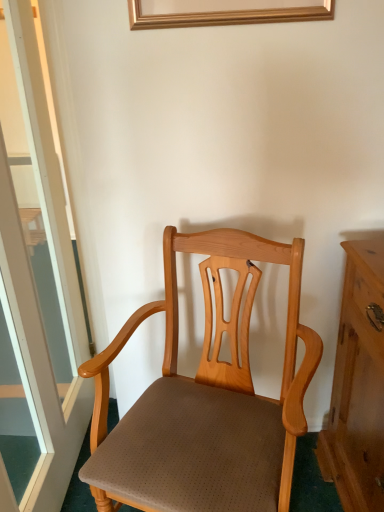
The height and width of the screenshot is (512, 384). What do you see at coordinates (35, 288) in the screenshot?
I see `transparent glass door at left` at bounding box center [35, 288].

Find the location of `transparent glass door at left`. transparent glass door at left is located at coordinates (35, 288).

What do you see at coordinates (204, 405) in the screenshot? I see `light brown wood chair at center` at bounding box center [204, 405].

In order to click on light brown wood chair at center in this screenshot , I will do `click(204, 405)`.

You are a GUI agent. You are given a task and a screenshot of the screen. Output one action in this format:
    pyautogui.click(x=<x>, y=<y>)
    Task: Click on the transparent glass door at left
    
    Given the screenshot: What is the action you would take?
    pyautogui.click(x=35, y=288)

Is transparent glass door at left to the left of light brown wood chair at center from the viewer's perspective?

Indeed, transparent glass door at left is positioned on the left side of light brown wood chair at center.

In the scene shown: Which object is more forward, transparent glass door at left or light brown wood chair at center?

transparent glass door at left.

Is point (24, 97) positioned after point (210, 402)?

Yes.

From the image's perspective, would you say transparent glass door at left is shown under light brown wood chair at center?

Actually, transparent glass door at left appears above light brown wood chair at center in the image.

From a real-world perspective, is transparent glass door at left above or below light brown wood chair at center?

transparent glass door at left is situated higher than light brown wood chair at center in the real world.

Considering the relative sizes of transparent glass door at left and light brown wood chair at center in the image provided, is transparent glass door at left wider than light brown wood chair at center?

No.

Between transparent glass door at left and light brown wood chair at center, which one has more height?

transparent glass door at left is taller.

Looking at the image, does transparent glass door at left seem bigger or smaller compared to light brown wood chair at center?

transparent glass door at left is smaller than light brown wood chair at center.

Choose the correct answer: Is transparent glass door at left inside light brown wood chair at center or outside it?

transparent glass door at left is outside light brown wood chair at center.

Are transparent glass door at left and light brown wood chair at center beside each other?

No.

Is light brown wood chair at center at the back of transparent glass door at left?

Yes.

How much distance is there between transparent glass door at left and light brown wood chair at center?

52.26 centimeters.

The width and height of the screenshot is (384, 512). I want to click on window that is in front of the light brown wood chair at center, so click(x=35, y=288).

Is light brown wood chair at center to the left of transparent glass door at left from the viewer's perspective?

Incorrect, light brown wood chair at center is not on the left side of transparent glass door at left.

Is light brown wood chair at center positioned behind transparent glass door at left?

Yes, it is behind transparent glass door at left.

Is point (247, 249) closer or farther from the camera than point (21, 106)?

Point (247, 249) appears to be closer to the viewer than point (21, 106).

From the image's perspective, which is above, light brown wood chair at center or transparent glass door at left?

transparent glass door at left is shown above in the image.

From a real-world perspective, who is located lower, light brown wood chair at center or transparent glass door at left?

light brown wood chair at center is physically lower.

Does light brown wood chair at center have a greater width compared to transparent glass door at left?

Indeed, light brown wood chair at center has a greater width compared to transparent glass door at left.

From the picture: Which of these two, light brown wood chair at center or transparent glass door at left, stands taller?

Standing taller between the two is transparent glass door at left.

Considering the relative sizes of light brown wood chair at center and transparent glass door at left in the image provided, is light brown wood chair at center smaller than transparent glass door at left?

Incorrect, light brown wood chair at center is not smaller in size than transparent glass door at left.

In the scene shown: Would you say light brown wood chair at center is inside or outside transparent glass door at left?

light brown wood chair at center is not inside transparent glass door at left, it's outside.

Does light brown wood chair at center touch transparent glass door at left?

No, light brown wood chair at center is not making contact with transparent glass door at left.

Is light brown wood chair at center oriented towards transparent glass door at left?

No, light brown wood chair at center is not aimed at transparent glass door at left.

How far apart are light brown wood chair at center and transparent glass door at left?

They are 20.58 inches apart.

Identify the location of window above the light brown wood chair at center (from the image's perspective). (35, 288).

What are the coordinates of `window above the light brown wood chair at center (from the image's perspective)` in the screenshot? It's located at coord(35,288).

What are the coordinates of `chair located underneath the transparent glass door at left (from a real-world perspective)` in the screenshot? It's located at click(204, 405).